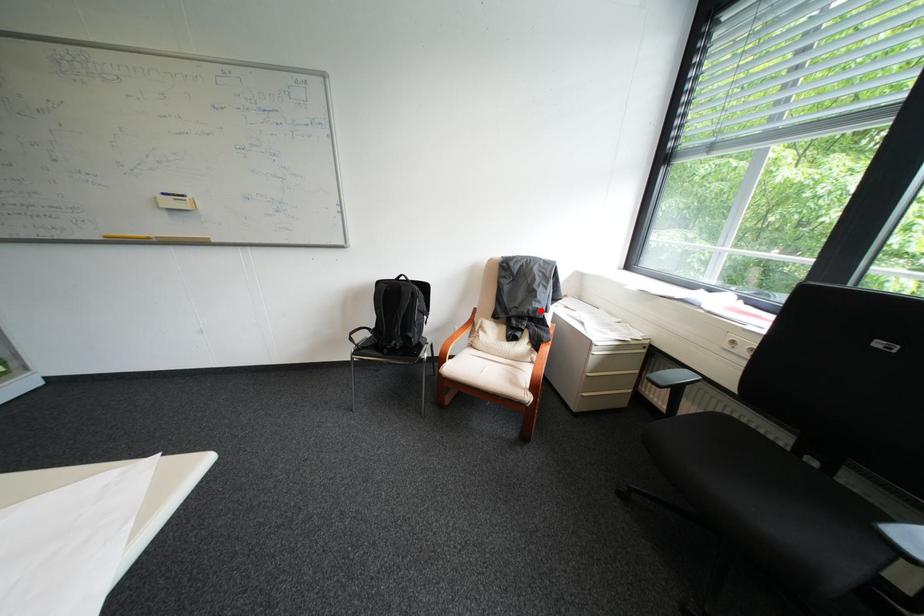
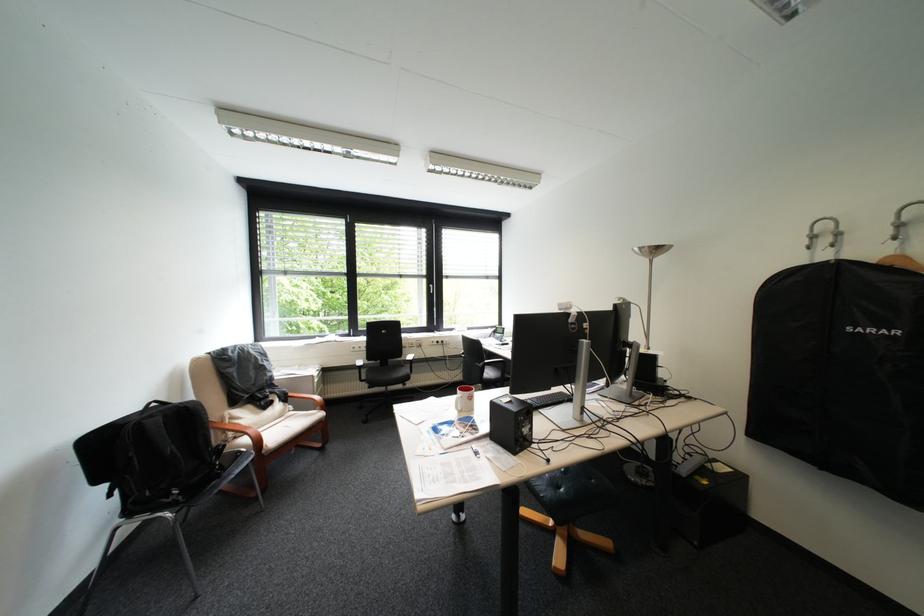
Find the pixel in the second image that matches the highlighted location in the first image.

(280, 381)